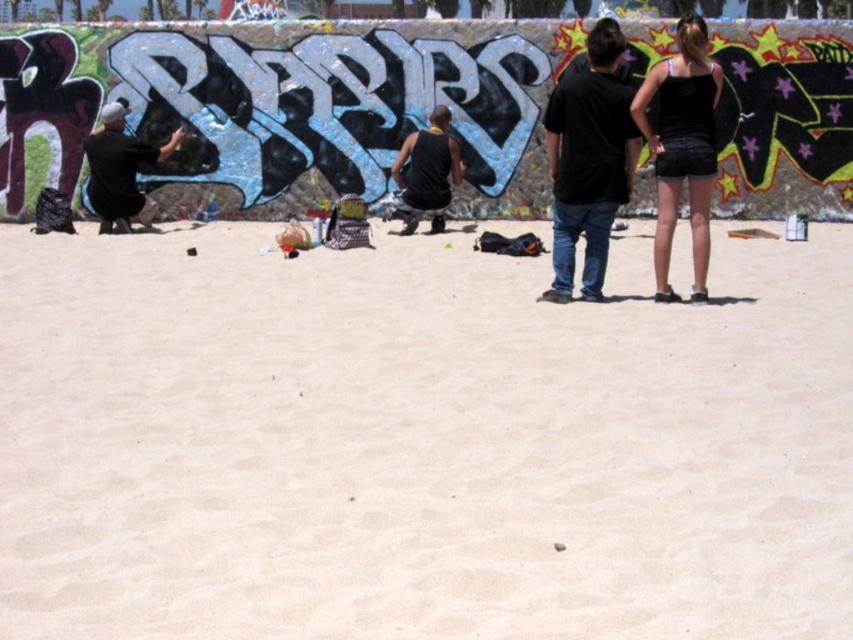
Question: Which object is the closest to the black matte shirt at left?

Choices:
 (A) black tank top at center
 (B) black leather shorts at upper right

Answer: (A)

Question: Does black leather shorts at upper right appear under black matte shirt at left?

Choices:
 (A) yes
 (B) no

Answer: (A)

Question: Which object appears closest to the camera in this image?

Choices:
 (A) black tank top at center
 (B) black leather shorts at upper right
 (C) black matte shirt at left

Answer: (B)

Question: Which point is closer to the camera?

Choices:
 (A) (590, 32)
 (B) (752, 557)

Answer: (B)

Question: Does black matte shirt at left have a smaller size compared to black tank top at center?

Choices:
 (A) no
 (B) yes

Answer: (A)

Question: From the image, what is the correct spatial relationship of black matte shirt at center in relation to black leather shorts at upper right?

Choices:
 (A) above
 (B) below

Answer: (A)